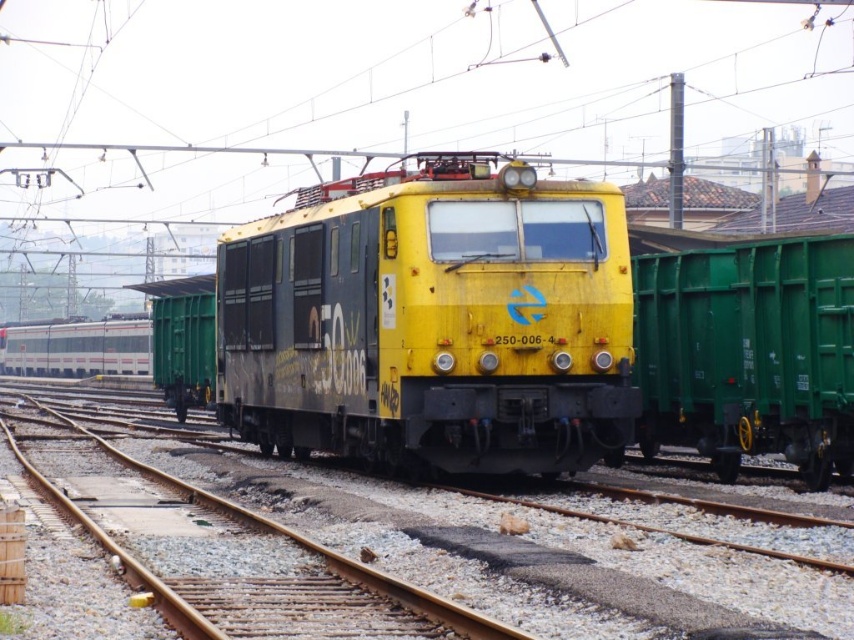
Question: Does yellow matte train at center come in front of green matte freight car at right?

Choices:
 (A) no
 (B) yes

Answer: (A)

Question: Can you confirm if yellow matte train at center is bigger than green matte freight car at right?

Choices:
 (A) no
 (B) yes

Answer: (B)

Question: Which of the following is the farthest from the observer?

Choices:
 (A) yellow matte train at center
 (B) green matte freight car at right

Answer: (A)

Question: Does yellow matte train at center have a greater width compared to green matte freight car at right?

Choices:
 (A) no
 (B) yes

Answer: (B)